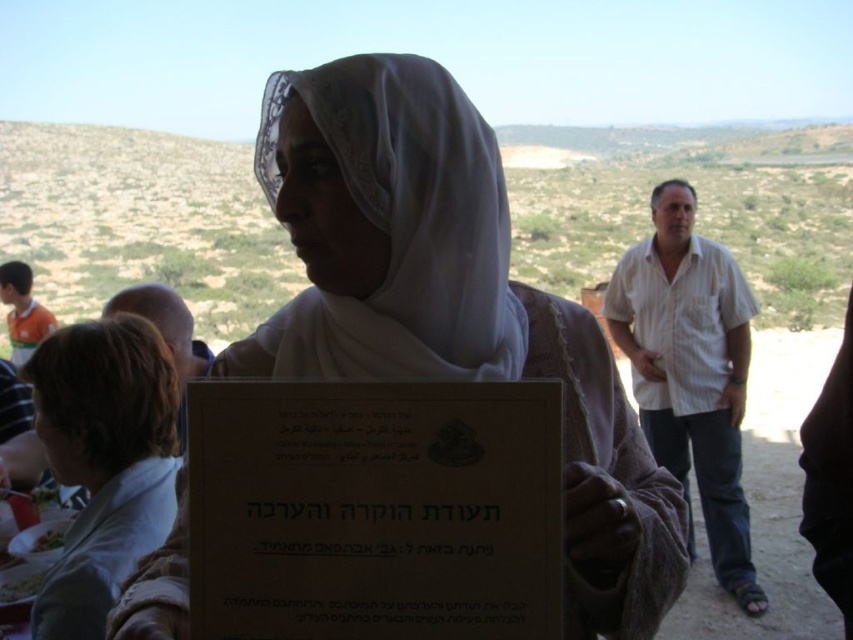
Does white glossy plate at lower left have a lesser width compared to green leafy vegetable at lower left?

In fact, white glossy plate at lower left might be wider than green leafy vegetable at lower left.

Is white glossy plate at lower left positioned in front of green leafy vegetable at lower left?

Yes, it is in front of green leafy vegetable at lower left.

Identify the location of white glossy plate at lower left. The image size is (853, 640). (19, 584).

Locate an element on the screen. This screenshot has width=853, height=640. white glossy plate at lower left is located at coordinates (19, 584).

Does point (550, 634) lie behind point (13, 570)?

No.

Which is behind, point (532, 452) or point (35, 580)?

Positioned behind is point (35, 580).

Between point (204, 602) and point (33, 577), which one is positioned in front?

Point (204, 602) is more forward.

This screenshot has height=640, width=853. Identify the location of brown cardboard plaque at center. (374, 509).

In the scene shown: Measure the distance between point (550, 560) and camera.

Point (550, 560) and camera are 31.79 inches apart.

This screenshot has width=853, height=640. I want to click on brown cardboard plaque at center, so click(x=374, y=509).